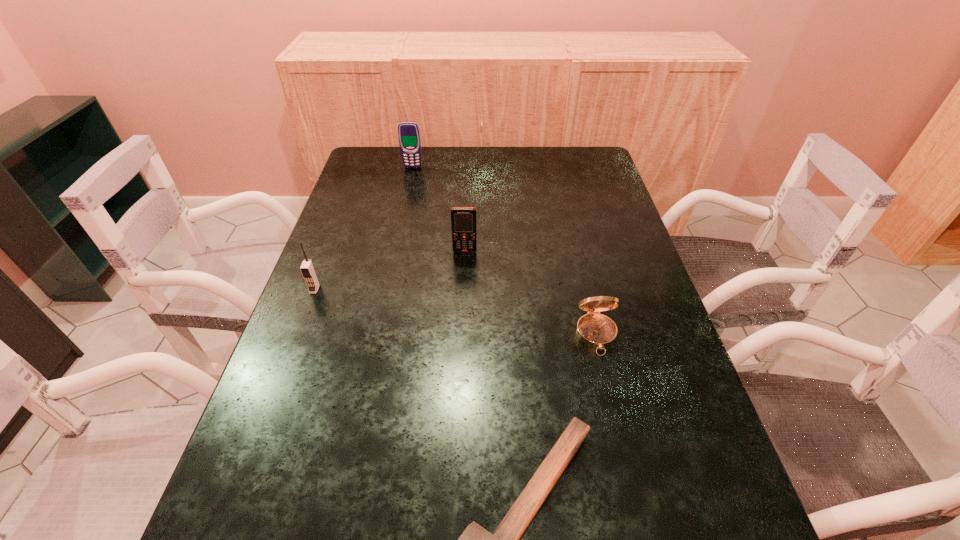
Identify the location of free space between the third farthest object and the farthest object. The image size is (960, 540). 364,228.

Locate an element on the screen. free space between the second nearest cellular telephone and the leftmost object is located at coordinates (390, 270).

Identify which object is the third nearest to the second shortest object. Please provide its 2D coordinates. Your answer should be formatted as a tuple, i.e. [(x, y)], where the tuple contains the x and y coordinates of a point satisfying the conditions above.

[(307, 268)]

In order to click on the fourth closest object to the nearest object in this screenshot , I will do click(x=409, y=136).

At what (x,y) coordinates should I click in order to perform the action: click on cellular telephone that is the third closest to the rightmost object. Please return your answer as a coordinate pair (x, y). This screenshot has height=540, width=960. Looking at the image, I should click on (409, 136).

Point out which cellular telephone is positioned as the nearest to the shortest object. Please provide its 2D coordinates. Your answer should be formatted as a tuple, i.e. [(x, y)], where the tuple contains the x and y coordinates of a point satisfying the conditions above.

[(463, 219)]